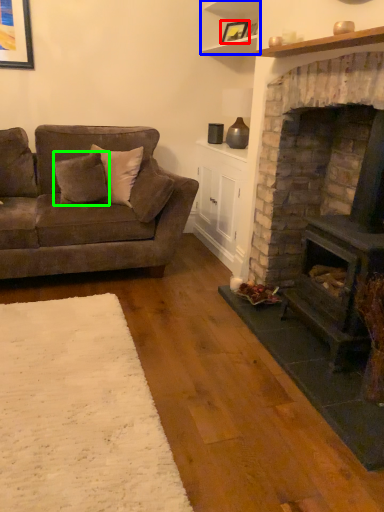
Question: Estimate the real-world distances between objects in this image. Which object is farther from picture frame (highlighted by a red box), shelf (highlighted by a blue box) or pillow (highlighted by a green box)?

Choices:
 (A) shelf
 (B) pillow

Answer: (B)